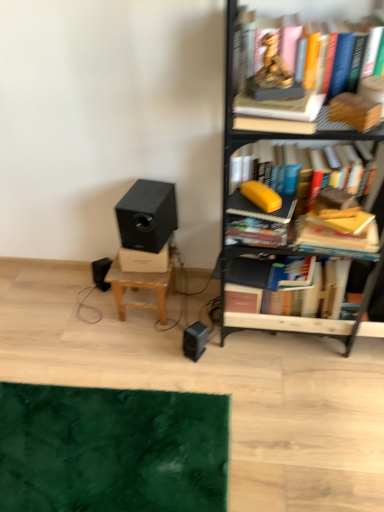
The width and height of the screenshot is (384, 512). Identify the location of free spot above matte yellow book at center, positioned as the 3th book in top-to-bottom order (from a real-world perspective). (259, 201).